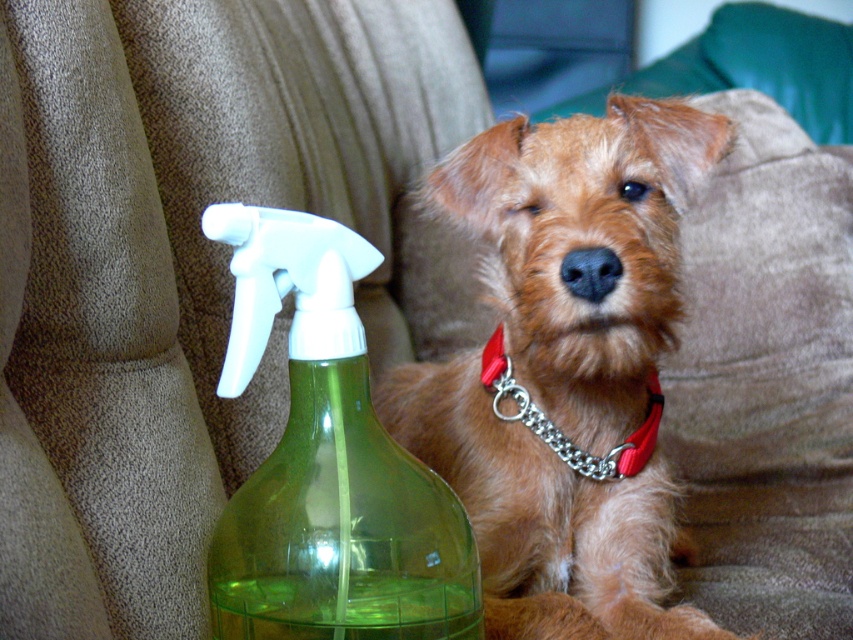
You are a photographer setting up a shot of the small dog on the beige couch. You need to ensure that the shiny brown fur at center and the red chain collar at center are both visible in the frame. Given their sizes, which object should you focus on to make sure both are in focus?

The shiny brown fur at center is much taller than the red chain collar at center, so focusing on the shiny brown fur at center will ensure both are in focus since it is larger and more prominent.

You are a small robot with a width of 12 inches. You need to move from the shiny brown fur at center to the green translucent bottle at center. Can you fit through the space between them?

The distance between the shiny brown fur at center and the green translucent bottle at center is 12.63 inches. Since the robot is 12 inches wide, it can fit through the space as there is enough clearance.

You are a photographer trying to capture the dog on the beige couch. You notice the shiny brown fur at center and the green translucent bottle at center. Which object is closer to the camera?

The shiny brown fur at center is positioned under the green translucent bottle at center, so the green translucent bottle at center is closer to the camera.